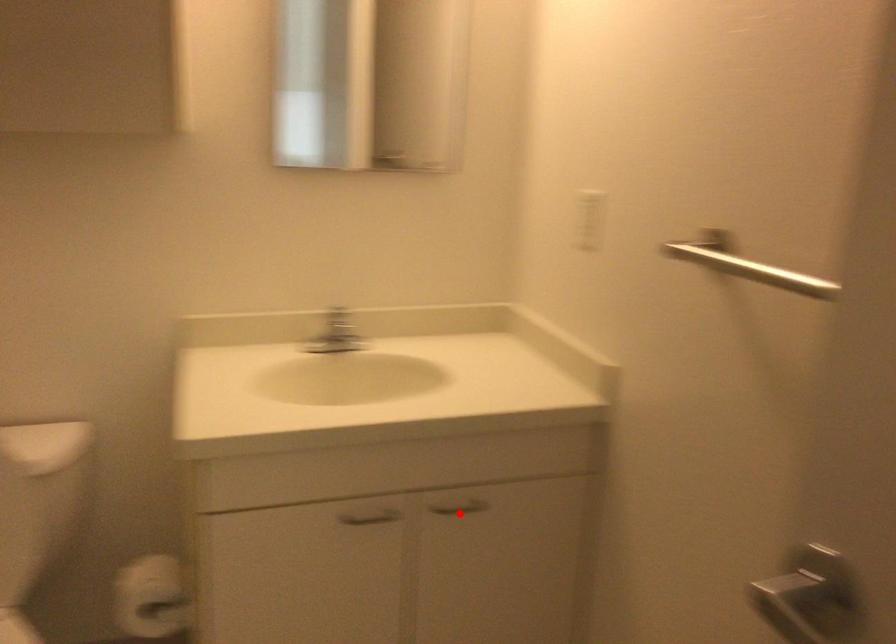
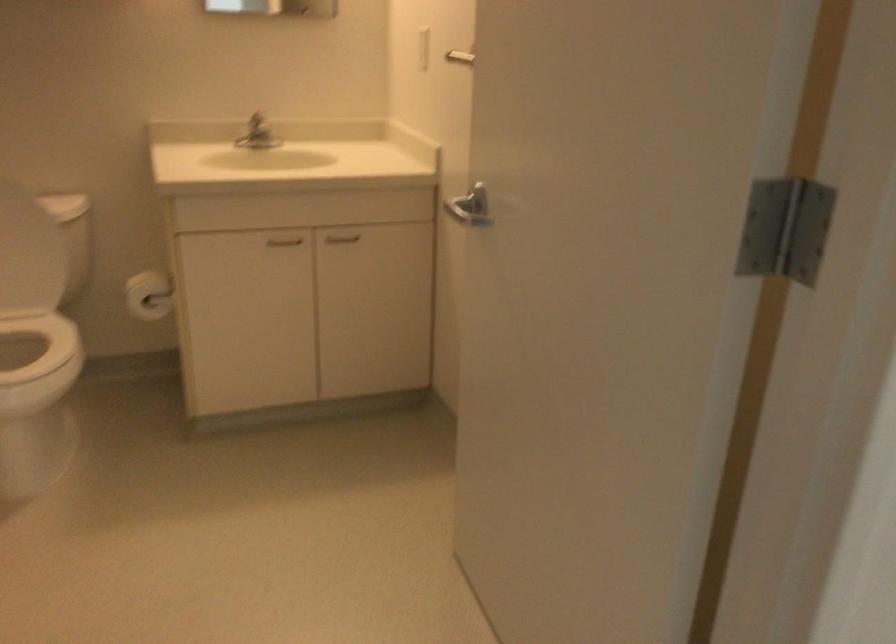
Question: I am providing you with two images of the same scene from different viewpoints. A red point is shown in image1. For the corresponding object point in image2, is it positioned nearer or farther from the camera?

Choices:
 (A) Nearer
 (B) Farther

Answer: (B)